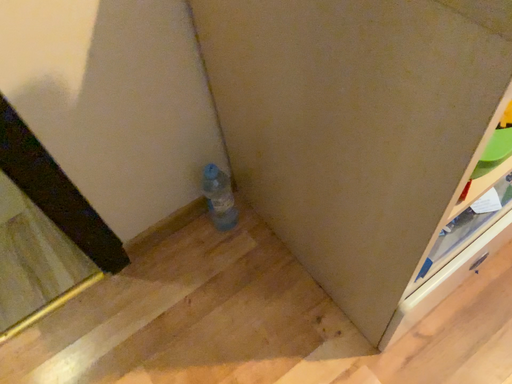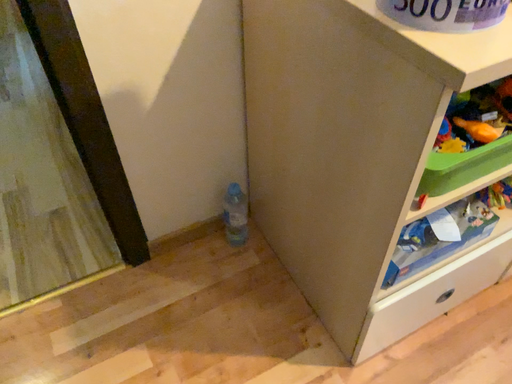
Question: How did the camera likely rotate when shooting the video?

Choices:
 (A) rotated upward
 (B) rotated downward

Answer: (A)